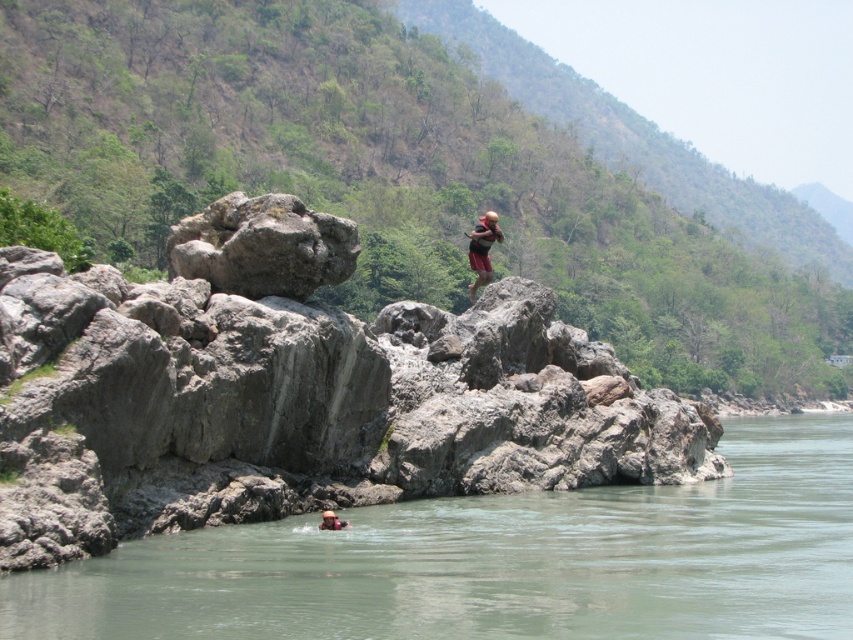
Question: Does greenish-gray water at lower left appear under tan skin person at upper center?

Choices:
 (A) yes
 (B) no

Answer: (A)

Question: Among these objects, which one is nearest to the camera?

Choices:
 (A) gray rough rock at center
 (B) greenish-gray water at lower left

Answer: (B)

Question: Is gray rough rock at center to the right of greenish-gray water at lower left from the viewer's perspective?

Choices:
 (A) yes
 (B) no

Answer: (B)

Question: Which point is farther from the camera taking this photo?

Choices:
 (A) (805, 528)
 (B) (709, 417)
 (C) (337, 516)
 (D) (490, 264)

Answer: (B)

Question: From the image, what is the correct spatial relationship of tan skin person at upper center in relation to brown leather life jacket at lower center?

Choices:
 (A) left
 (B) right

Answer: (B)

Question: Which point is closer to the camera?

Choices:
 (A) (329, 513)
 (B) (553, 621)
 (C) (212, 364)
 (D) (483, 221)

Answer: (B)